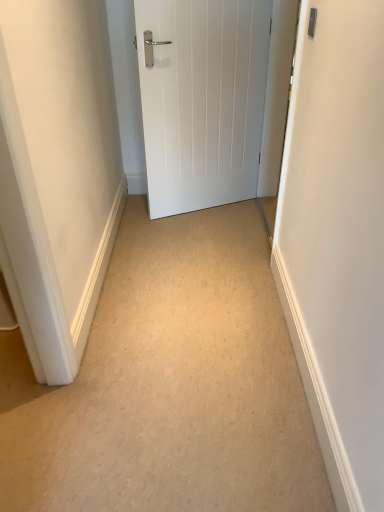
You are a GUI agent. You are given a task and a screenshot of the screen. Output one action in this format:
    pyautogui.click(x=<x>, y=<y>)
    Task: Click on the vacant area situated below white matte door at center (from a real-world perspective)
    This screenshot has width=384, height=512.
    Given the screenshot: What is the action you would take?
    pyautogui.click(x=210, y=205)